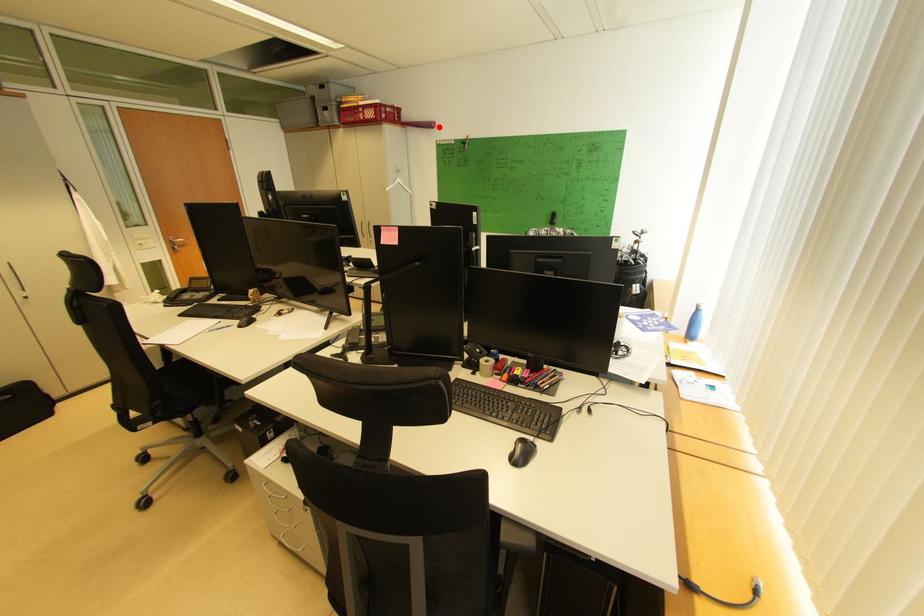
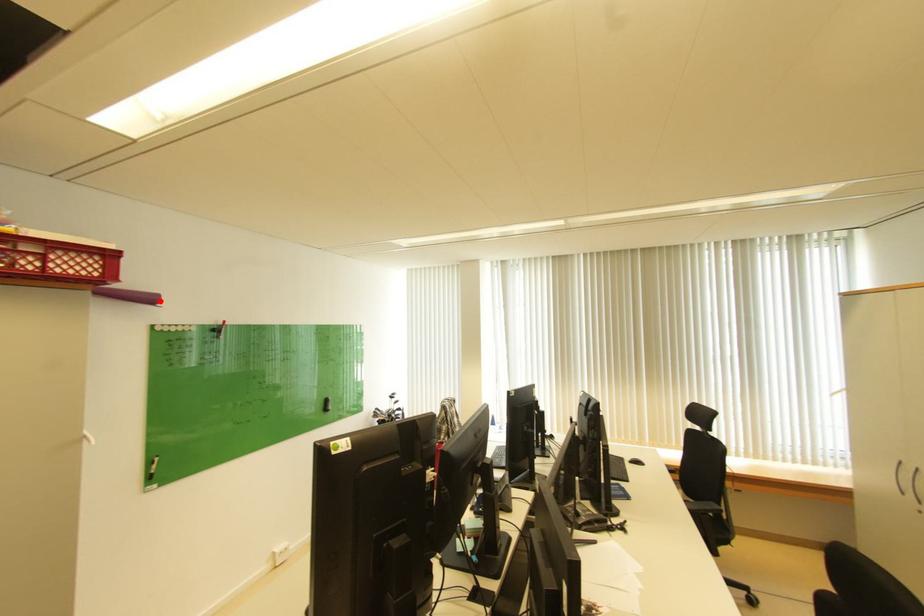
I am providing you with two images of the same scene from different viewpoints. A red point is marked on the first image and another point is marked on the second image. Do the highlighted points in image1 and image2 indicate the same real-world spot?

Yes